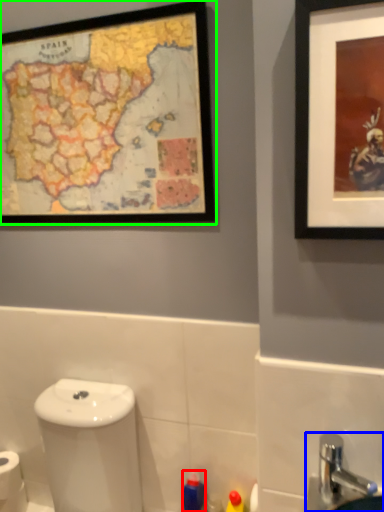
Question: Considering the real-world distances, which object is closest to toiletry (highlighted by a red box)? sink (highlighted by a blue box) or picture frame (highlighted by a green box).

Choices:
 (A) sink
 (B) picture frame

Answer: (A)